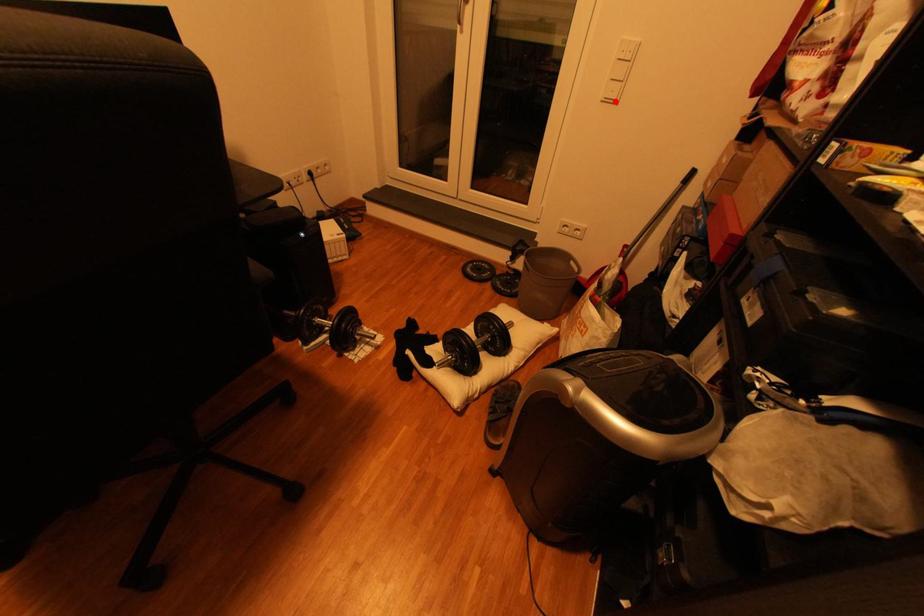
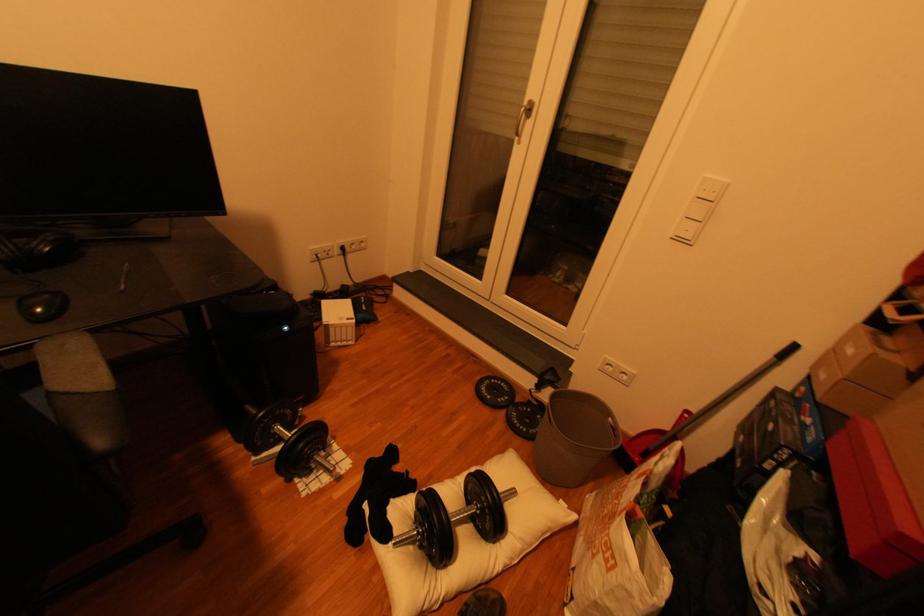
Locate, in the second image, the point that corresponds to the highlighted location in the first image.

(687, 240)